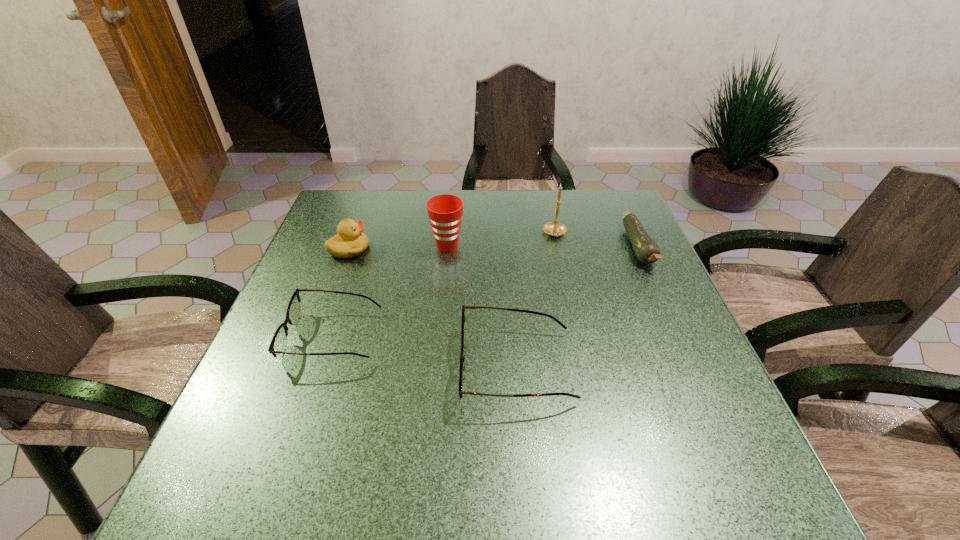
Where is `the fifth closest object relative to the candle holder`? The width and height of the screenshot is (960, 540). the fifth closest object relative to the candle holder is located at coordinates (349, 242).

Identify the location of object that is the third nearest to the cup. The width and height of the screenshot is (960, 540). (554, 228).

This screenshot has height=540, width=960. Identify the location of vacant area in the image that satisfies the following two spatial constraints: 1. on the handle side of the candle holder; 2. on the front-facing side of the fourth shortest object. (558, 249).

Find the location of a particular element. This screenshot has width=960, height=540. blank area in the image that satisfies the following two spatial constraints: 1. on the handle side of the candle holder; 2. on the front-facing side of the duckling is located at coordinates (558, 249).

This screenshot has width=960, height=540. I want to click on blank space that satisfies the following two spatial constraints: 1. at the blossom end of the zucchini; 2. on the face of the shorter spectacles, so click(x=678, y=336).